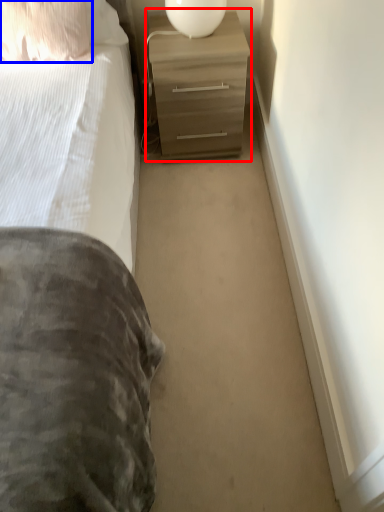
Question: Among these objects, which one is nearest to the camera, chest of drawers (highlighted by a red box) or pillow (highlighted by a blue box)?

Choices:
 (A) chest of drawers
 (B) pillow

Answer: (B)